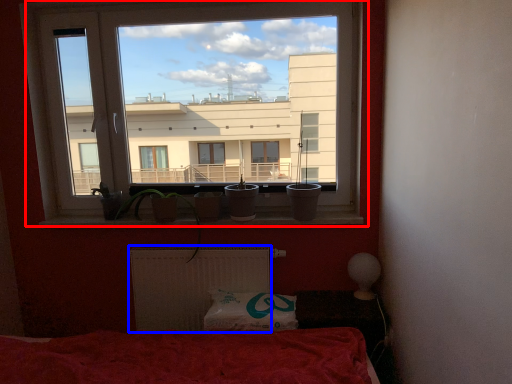
Question: Which object is closer to the camera taking this photo, window (highlighted by a red box) or radiator (highlighted by a blue box)?

Choices:
 (A) window
 (B) radiator

Answer: (A)